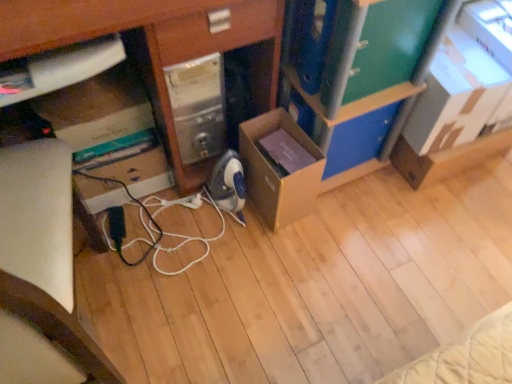
This screenshot has width=512, height=384. I want to click on free location to the right of brown cardboard box at center, positioned as the second cardboard box in right-to-left order, so click(346, 210).